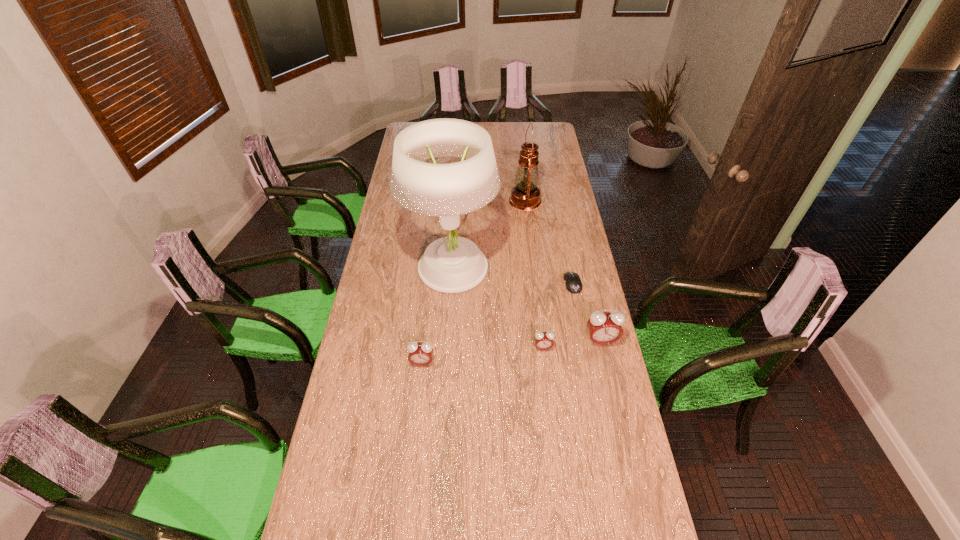
This screenshot has height=540, width=960. In order to click on the second shortest alarm clock in this screenshot , I will do `click(420, 354)`.

Image resolution: width=960 pixels, height=540 pixels. I want to click on the nearest alarm clock, so click(420, 354).

Where is `the second shortest object`? The width and height of the screenshot is (960, 540). the second shortest object is located at coordinates (543, 340).

You are a GUI agent. You are given a task and a screenshot of the screen. Output one action in this format:
    pyautogui.click(x=<x>, y=<y>)
    Task: Click on the shortest alarm clock
    The width and height of the screenshot is (960, 540).
    Given the screenshot: What is the action you would take?
    pyautogui.click(x=543, y=340)

The width and height of the screenshot is (960, 540). I want to click on the rightmost alarm clock, so click(604, 327).

Find the location of a particular element. The width and height of the screenshot is (960, 540). the third tallest object is located at coordinates (604, 327).

The height and width of the screenshot is (540, 960). I want to click on oil lamp, so click(x=525, y=195).

Find the location of a particular element. The width and height of the screenshot is (960, 540). the farthest object is located at coordinates (525, 195).

Identify the location of lamp. The width and height of the screenshot is (960, 540). (452, 264).

Find the location of a particular element. the shortest object is located at coordinates (572, 280).